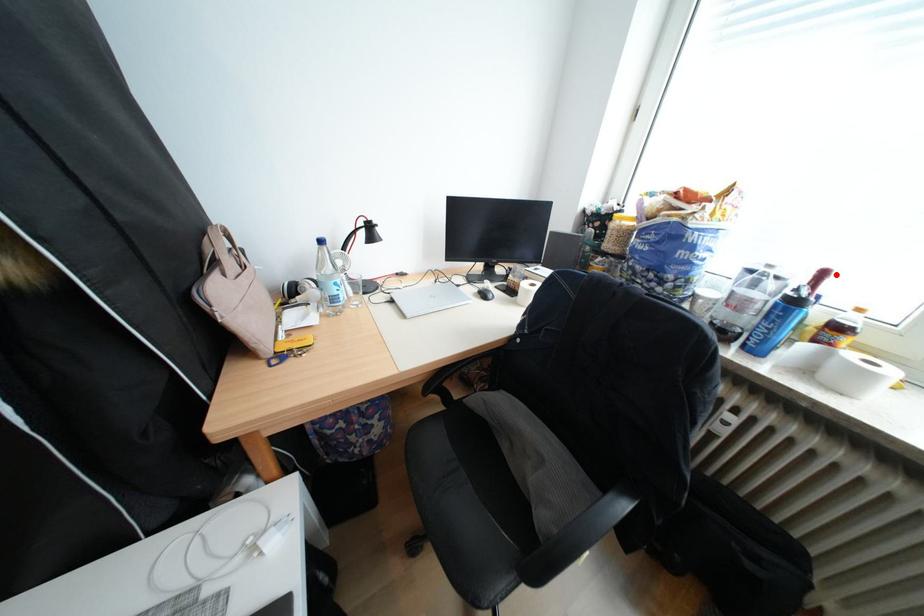
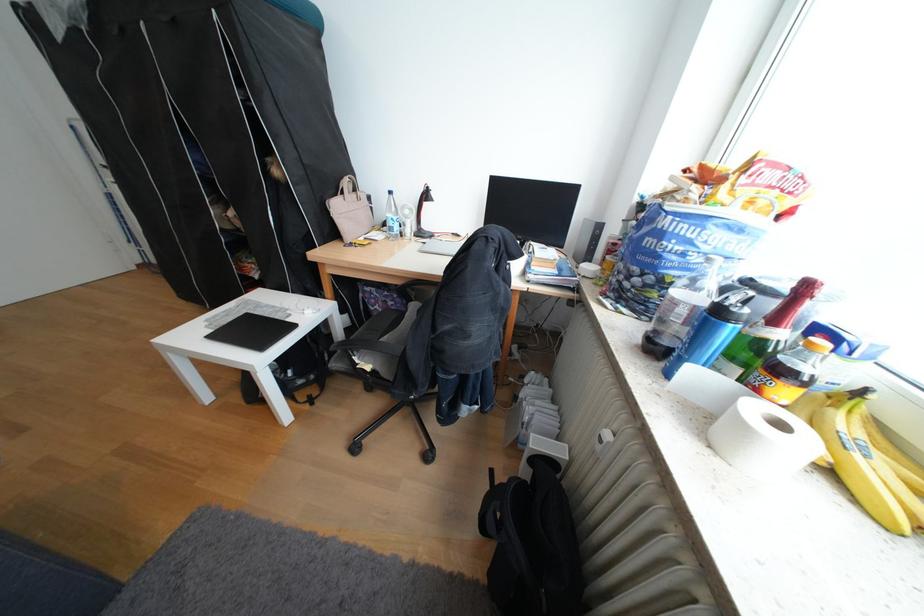
Where in the second image is the point corresponding to the highlighted location from the first image?

(819, 288)